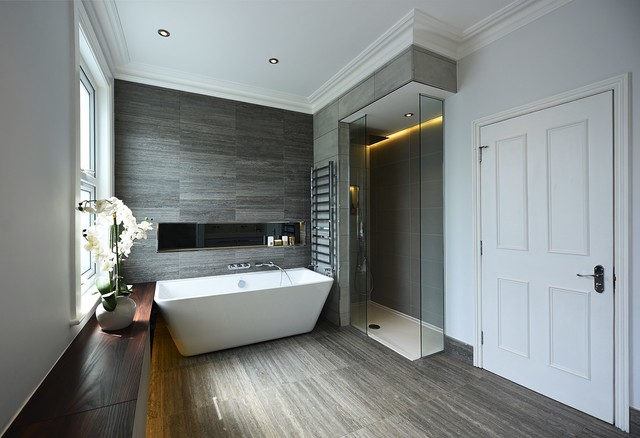
At what (x,y) coordinates should I click in order to perform the action: click on trim. Please return your answer as a coordinate pair (x, y). Image resolution: width=640 pixels, height=438 pixels. Looking at the image, I should click on (388, 51).